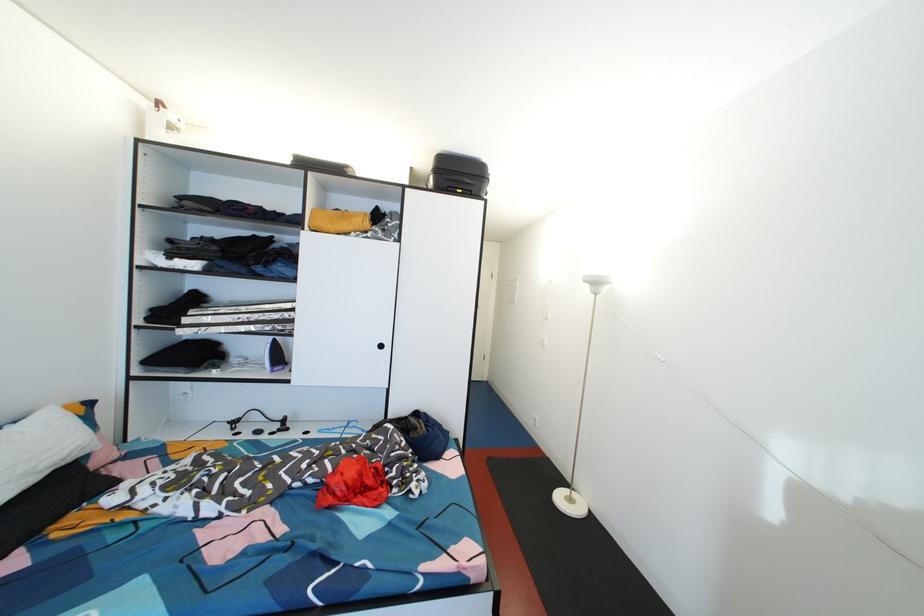
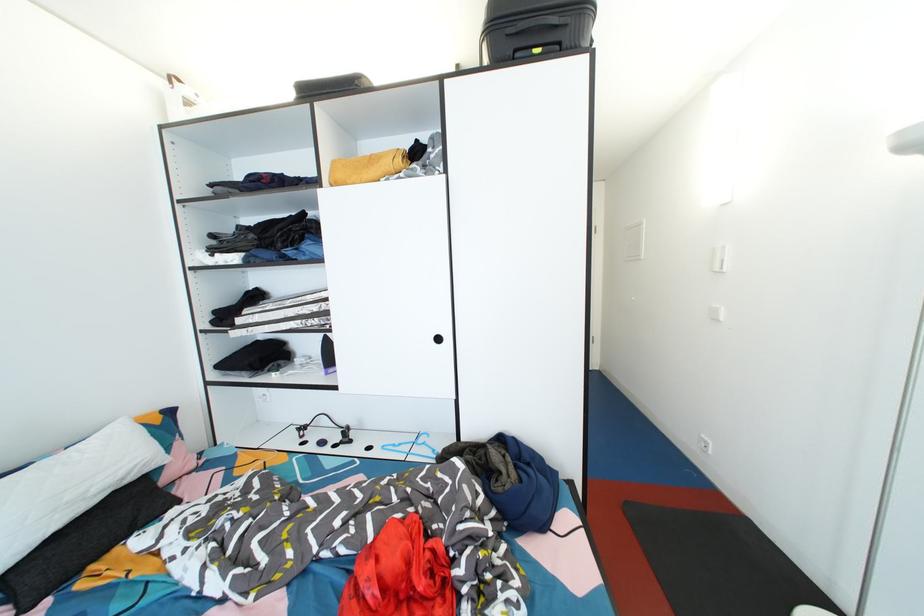
The point at (591, 286) is marked in the first image. Where is the corresponding point in the second image?

(913, 152)